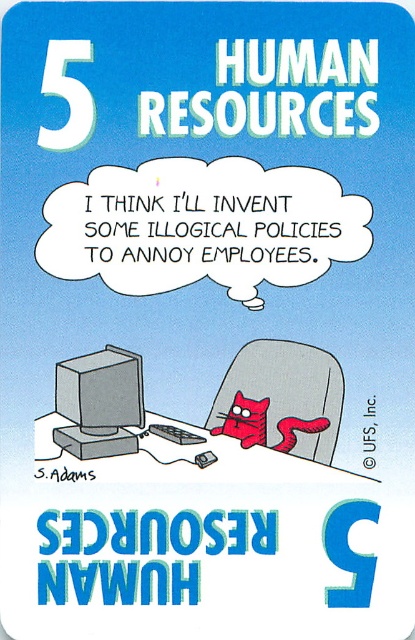
You are a delivery robot with a height of 4 feet. You need to deliver a package to the desk where the red cat is sitting at point (x=300, y=394). Can you safely pass under the desk without hitting your head?

The distance between point (x=300, y=394) and the camera is 3.96 feet. Since the robot is 4 feet tall, it cannot safely pass under the desk without hitting its head as the clearance is less than its height.

In the cartoon scene, there is a gray fabric chair at center and a matte gray monitor at center. Which object is wider?

The gray fabric chair at center is wider than the matte gray monitor at center.

You are an employee entering the office and need to sit down at the desk where both the gray fabric chair at center and the matte gray monitor at center are located. Which object will you encounter first as you approach the desk?

You will encounter the gray fabric chair at center first because it is closer to you than the matte gray monitor at center, which is further away.